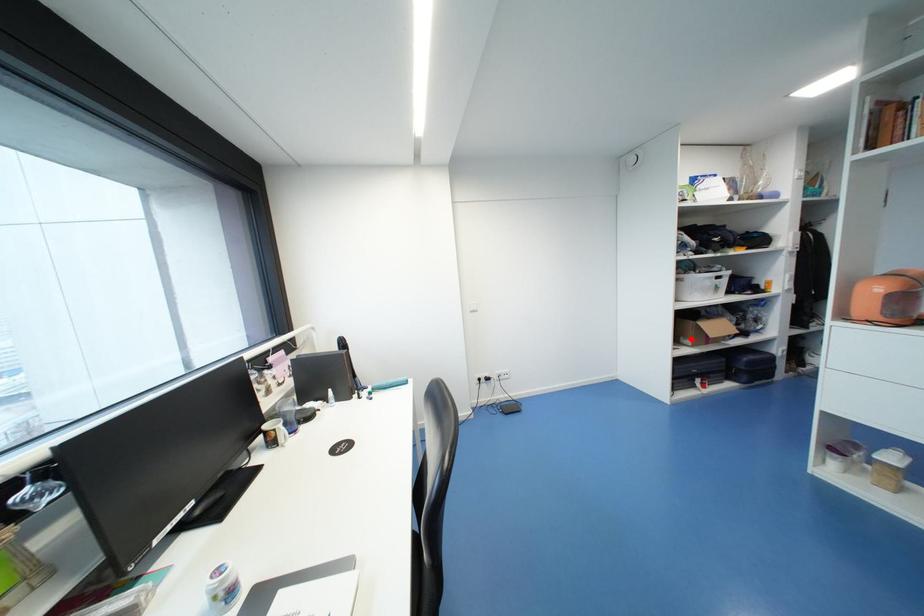
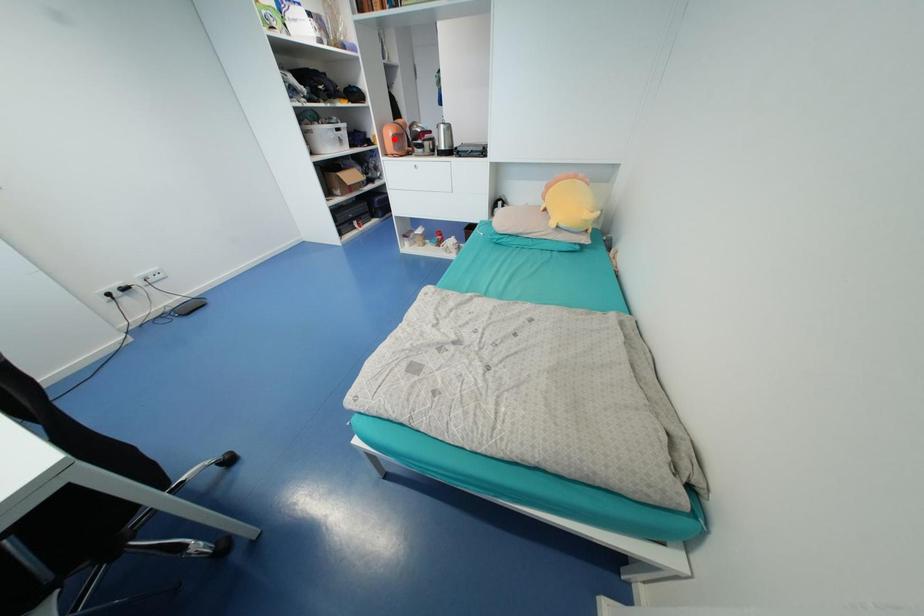
I am providing you with two images of the same scene from different viewpoints. A red point is marked on the first image and another point is marked on the second image. Does the point marked in image1 correspond to the same location as the one in image2?

No